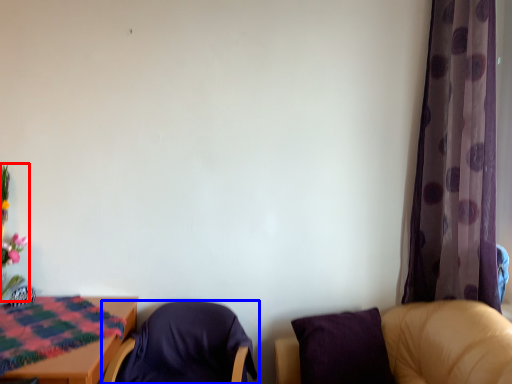
Question: Which point is further to the camera, floral arrangement (highlighted by a red box) or chair (highlighted by a blue box)?

Choices:
 (A) floral arrangement
 (B) chair

Answer: (A)